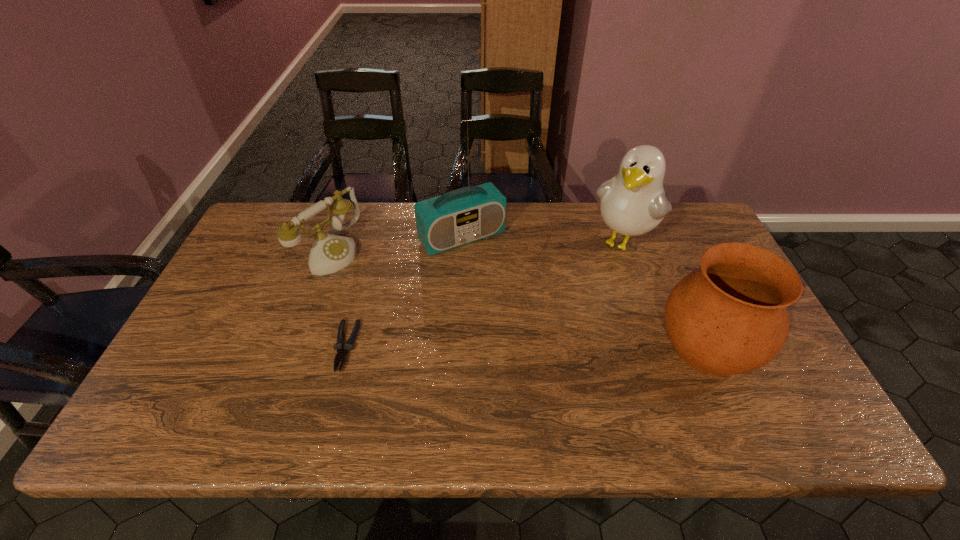
Locate an element on the screen. The image size is (960, 540). vacant spot on the desktop that is between the shortest object and the pottery and is positioned on the dial of the telephone is located at coordinates (498, 347).

At what (x,y) coordinates should I click in order to perform the action: click on vacant space on the desktop that is between the pliers and the third tallest object and is positioned on the front panel of the third object from right to left. Please return your answer as a coordinate pair (x, y). Looking at the image, I should click on (541, 347).

Where is `free space on the desktop that is between the pliers and the pottery and is positioned on the beak of the second tallest object`? free space on the desktop that is between the pliers and the pottery and is positioned on the beak of the second tallest object is located at coordinates (545, 347).